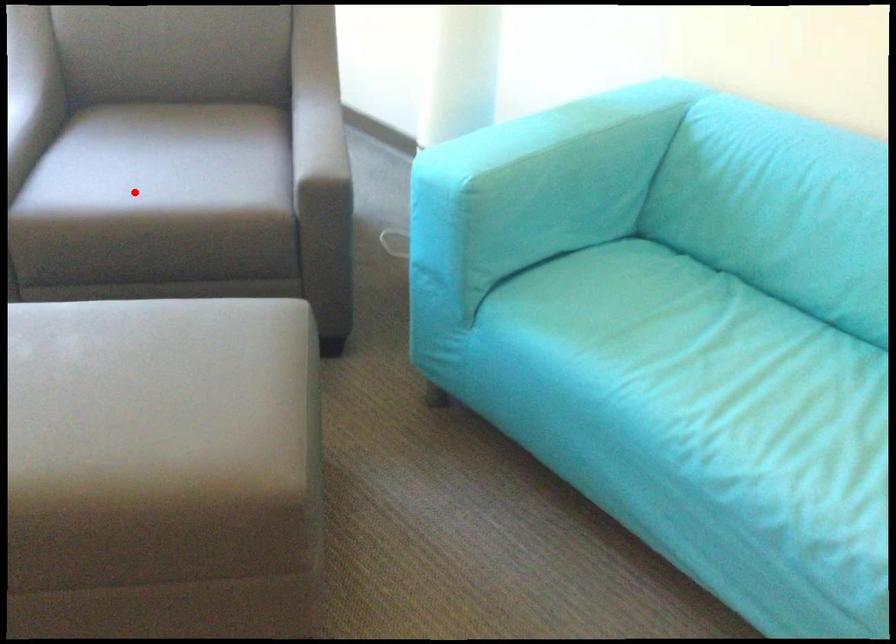
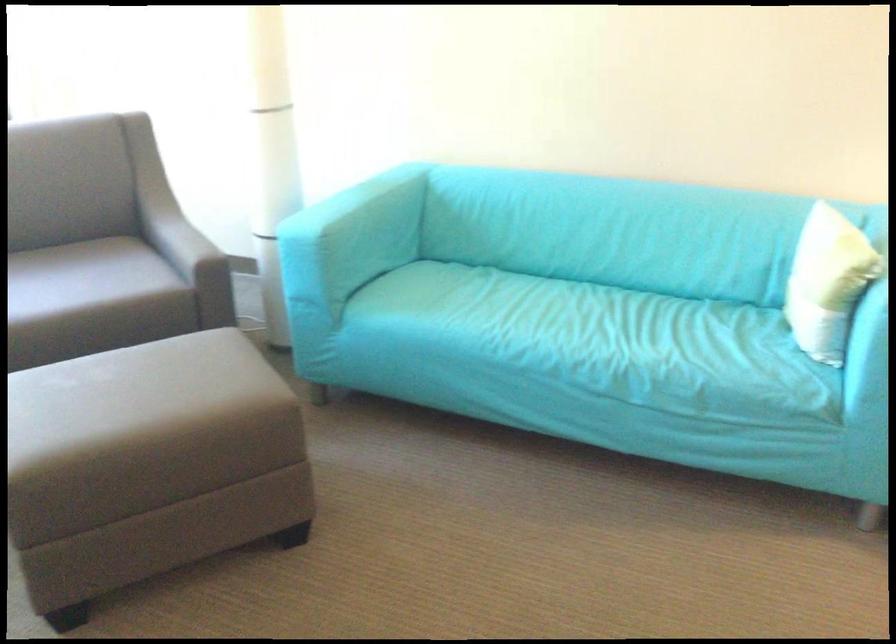
Question: I am providing you with two images of the same scene from different viewpoints. A red point is shown in image1. For the corresponding object point in image2, is it positioned nearer or farther from the camera?

Choices:
 (A) Nearer
 (B) Farther

Answer: (B)